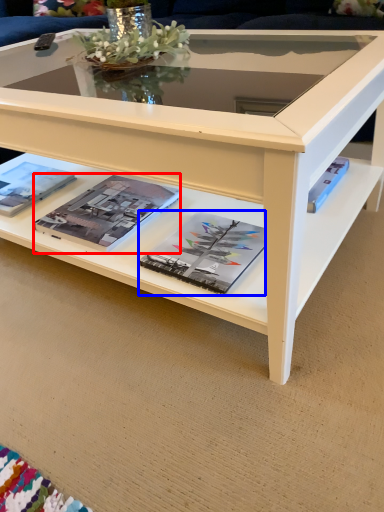
Question: Which object is closer to the camera taking this photo, magazine (highlighted by a red box) or magazine (highlighted by a blue box)?

Choices:
 (A) magazine
 (B) magazine

Answer: (B)